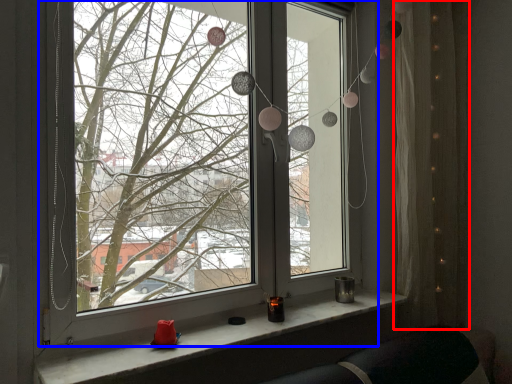
Question: Which object is further to the camera taking this photo, curtain (highlighted by a red box) or window (highlighted by a blue box)?

Choices:
 (A) curtain
 (B) window

Answer: (A)